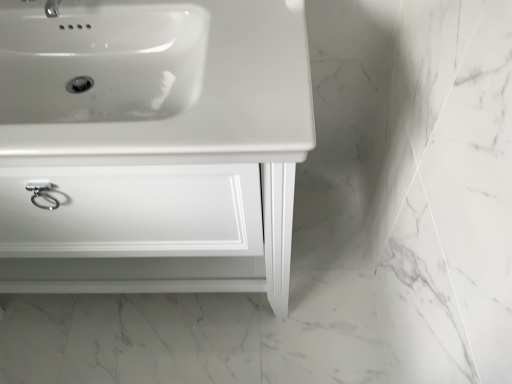
Describe the element at coordinates (172, 175) in the screenshot. The width and height of the screenshot is (512, 384). I see `white glossy cabinet at center` at that location.

At what (x,y) coordinates should I click in order to perform the action: click on white glossy cabinet at center. Please return your answer as a coordinate pair (x, y). The width and height of the screenshot is (512, 384). Looking at the image, I should click on (172, 175).

From the picture: What is the approximate width of white glossy cabinet at center?

white glossy cabinet at center is 21.26 inches wide.

Measure the distance between white glossy cabinet at center and camera.

white glossy cabinet at center and camera are 26.02 inches apart from each other.

Locate an element on the screen. This screenshot has height=384, width=512. white glossy cabinet at center is located at coordinates (172, 175).